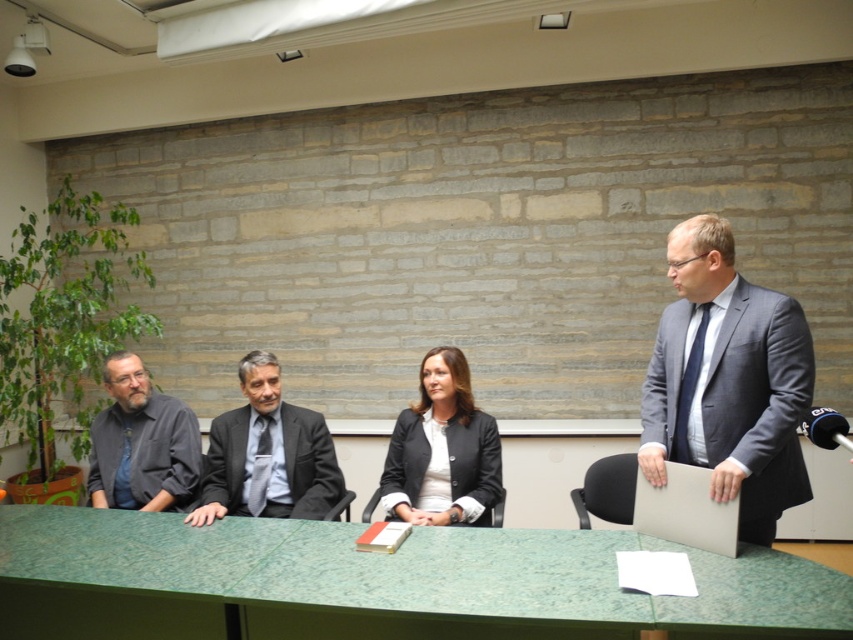
You are attending a formal meeting and need to place a name tag on the matte black blazer at center. Where exactly should you place it?

The matte black blazer at center is located at point (442, 451), so you should place the name tag at that coordinate.